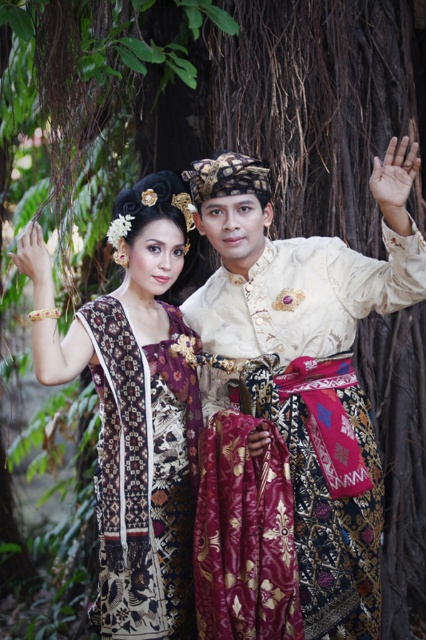
Question: In this image, where is matte batik dress at center located relative to batik dress at center?

Choices:
 (A) left
 (B) right

Answer: (A)

Question: Does matte batik dress at center lie in front of batik dress at center?

Choices:
 (A) no
 (B) yes

Answer: (B)

Question: Is matte batik dress at center to the right of batik dress at center from the viewer's perspective?

Choices:
 (A) yes
 (B) no

Answer: (B)

Question: Which point is farther to the camera?

Choices:
 (A) (123, 561)
 (B) (104, 490)

Answer: (B)

Question: Which point is farther from the camera taking this photo?

Choices:
 (A) (x=117, y=362)
 (B) (x=104, y=330)

Answer: (B)